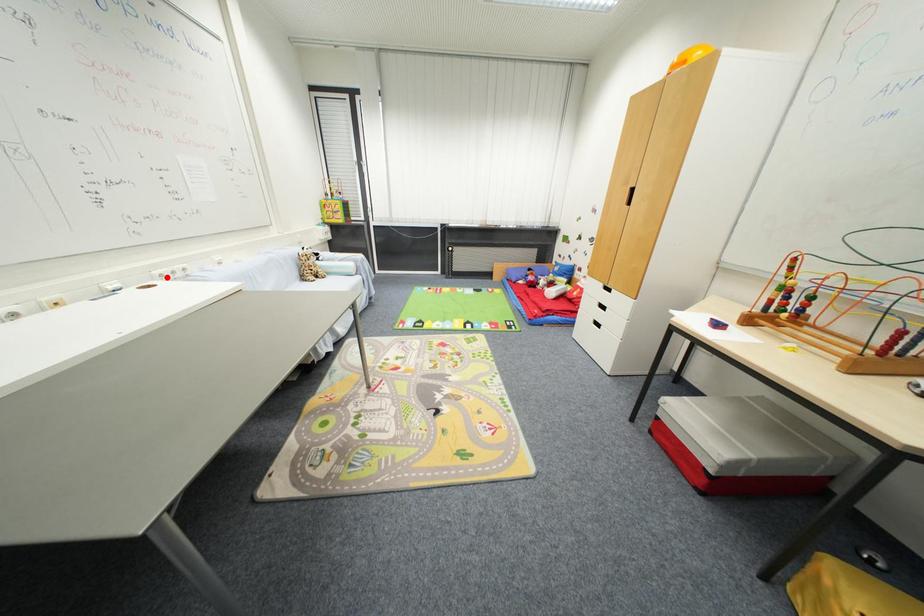
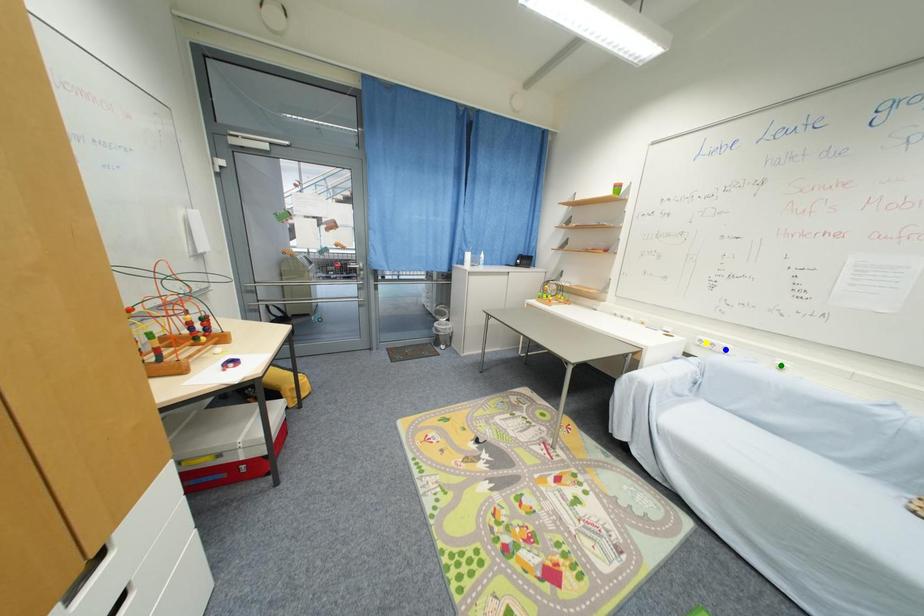
Question: I am providing you with two images of the same scene from different viewpoints. A red point is marked on the first image. You are given multiple points on the second image. Which point in image 2 represents the same 3d spot as the red point in image 1?

Choices:
 (A) blue point
 (B) green point
 (C) yellow point

Answer: (C)